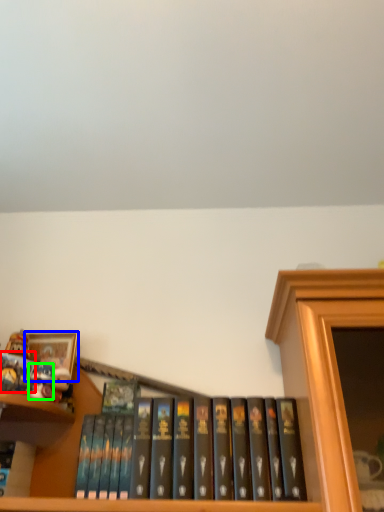
Question: Based on their relative distances, which object is nearer to book (highlighted by a red box)? Choose from picture frame (highlighted by a blue box) and toy (highlighted by a green box).

Choices:
 (A) picture frame
 (B) toy

Answer: (B)